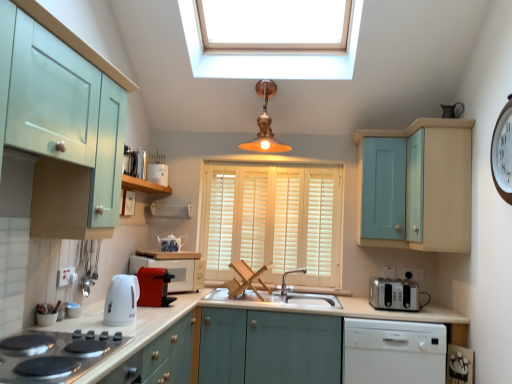
Where is `free point to the right of white glossy electric kettle at lower left`? The image size is (512, 384). free point to the right of white glossy electric kettle at lower left is located at coordinates (149, 324).